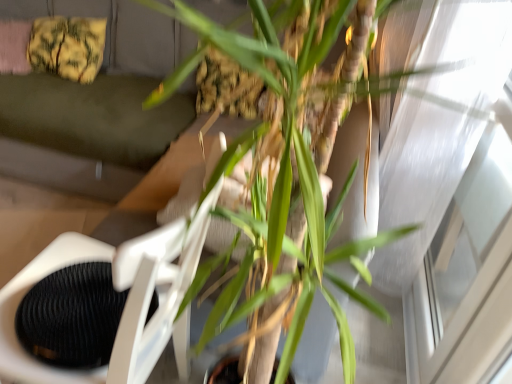
Image resolution: width=512 pixels, height=384 pixels. Describe the element at coordinates (451, 195) in the screenshot. I see `transparent glass window at upper right` at that location.

Describe the element at coordinates (125, 308) in the screenshot. I see `white plastic swivel chair at center` at that location.

In order to click on transparent glass window at upper right in this screenshot , I will do `click(451, 195)`.

How many degrees apart are the facing directions of transparent glass window at upper right and white plastic swivel chair at center?

There is a 3.96-degree angle between the facing directions of transparent glass window at upper right and white plastic swivel chair at center.

Which is behind, point (426, 151) or point (145, 281)?

The point (426, 151) is farther from the camera.

How much distance is there between transparent glass window at upper right and white plastic swivel chair at center?

A distance of 36.02 inches exists between transparent glass window at upper right and white plastic swivel chair at center.

From their relative heights in the image, would you say transparent glass window at upper right is taller or shorter than white plastic swivel chair at center?

Considering their sizes, transparent glass window at upper right has more height than white plastic swivel chair at center.

I want to click on couch that is above the transparent glass window at upper right (from the image's perspective), so click(x=100, y=89).

Between transparent glass window at upper right and green fabric couch at upper center, which one has less height?

With less height is green fabric couch at upper center.

From a real-world perspective, is transparent glass window at upper right below green fabric couch at upper center?

No.

Is transparent glass window at upper right wider than green fabric couch at upper center?

No.

Considering the positions of points (32, 38) and (260, 129), is point (32, 38) closer to camera compared to point (260, 129)?

No, (32, 38) is further to viewer.

From the picture: Between yellow fabric pillow at upper left and green leafy plant at center, which one has larger size?

green leafy plant at center.

Are yellow fabric pillow at upper left and green leafy plant at center beside each other?

They are not placed beside each other.

Which object is positioned more to the right, yellow fabric pillow at upper left or green leafy plant at center?

Positioned to the right is green leafy plant at center.

How many degrees apart are the facing directions of yellow fabric pillow at upper left and white plastic swivel chair at center?

The facing directions of yellow fabric pillow at upper left and white plastic swivel chair at center are 104 degrees apart.

Consider the image. Is yellow fabric pillow at upper left not near white plastic swivel chair at center?

Indeed, yellow fabric pillow at upper left is not near white plastic swivel chair at center.

Consider the image. Which of these two, yellow fabric pillow at upper left or white plastic swivel chair at center, is bigger?

white plastic swivel chair at center.

From the image's perspective, would you say yellow fabric pillow at upper left is positioned over white plastic swivel chair at center?

Yes, from the image's perspective, yellow fabric pillow at upper left is over white plastic swivel chair at center.

Is white plastic swivel chair at center oriented towards yellow fabric pillow at upper left?

No.

You are a GUI agent. You are given a task and a screenshot of the screen. Output one action in this format:
    pyautogui.click(x=<x>, y=<y>)
    Task: Click on the pillow that is on the left side of white plastic swivel chair at center
    
    Given the screenshot: What is the action you would take?
    pyautogui.click(x=67, y=47)

From a real-world perspective, is white plastic swivel chair at center physically located above or below yellow fabric pillow at upper left?

white plastic swivel chair at center is situated lower than yellow fabric pillow at upper left in the real world.

Is white plastic swivel chair at center next to yellow fabric pillow at upper left and touching it?

There is a gap between white plastic swivel chair at center and yellow fabric pillow at upper left.

Are green fabric couch at upper center and yellow fabric pillow at upper left making contact?

green fabric couch at upper center and yellow fabric pillow at upper left are clearly separated.

How much distance is there between green fabric couch at upper center and yellow fabric pillow at upper left?

green fabric couch at upper center and yellow fabric pillow at upper left are 21.66 centimeters apart.

Is point (32, 128) less distant than point (91, 67)?

Yes, it is in front of point (91, 67).

How many degrees apart are the facing directions of green fabric couch at upper center and yellow fabric pillow at upper left?

They differ by 9.56 degrees in their facing directions.

Is green fabric couch at upper center positioned in front of green leafy plant at center?

No, it is behind green leafy plant at center.

Considering the sizes of green fabric couch at upper center and green leafy plant at center in the image, is green fabric couch at upper center wider or thinner than green leafy plant at center?

In the image, green fabric couch at upper center appears to be wider than green leafy plant at center.

Is green fabric couch at upper center taller or shorter than green leafy plant at center?

In the image, green fabric couch at upper center appears to be shorter than green leafy plant at center.

Based on the photo, is green fabric couch at upper center facing towards green leafy plant at center?

No, green fabric couch at upper center is not aimed at green leafy plant at center.

The width and height of the screenshot is (512, 384). Find the location of `window that appears above the white plastic swivel chair at center (from a real-world perspective)`. window that appears above the white plastic swivel chair at center (from a real-world perspective) is located at coordinates [x=451, y=195].

Where is `window that appears on the right of green fabric couch at upper center`? window that appears on the right of green fabric couch at upper center is located at coordinates (451, 195).

Which object lies further to the anchor point green fabric couch at upper center, green leafy plant at center or yellow fabric pillow at upper left?

green leafy plant at center is positioned further to the anchor green fabric couch at upper center.

Which object lies nearer to the anchor point transparent glass window at upper right, yellow fabric pillow at upper left or white plastic swivel chair at center?

white plastic swivel chair at center is closer to transparent glass window at upper right.

Estimate the real-world distances between objects in this image. Which object is closer to green fabric couch at upper center, green leafy plant at center or white plastic swivel chair at center?

white plastic swivel chair at center is positioned closer to the anchor green fabric couch at upper center.

Looking at the image, which one is located further to white plastic swivel chair at center, green fabric couch at upper center or transparent glass window at upper right?

green fabric couch at upper center is positioned further to the anchor white plastic swivel chair at center.

When comparing their distances from green fabric couch at upper center, does green leafy plant at center or transparent glass window at upper right seem closer?

green leafy plant at center is closer to green fabric couch at upper center.

Considering their positions, is white plastic swivel chair at center positioned closer to green fabric couch at upper center than green leafy plant at center?

white plastic swivel chair at center is closer to green fabric couch at upper center.

When comparing their distances from transparent glass window at upper right, does green leafy plant at center or white plastic swivel chair at center seem further?

The object further to transparent glass window at upper right is white plastic swivel chair at center.

Considering their positions, is green leafy plant at center positioned further to white plastic swivel chair at center than yellow fabric pillow at upper left?

yellow fabric pillow at upper left is positioned further to the anchor white plastic swivel chair at center.

Locate an element on the screen. The height and width of the screenshot is (384, 512). window positioned between green leafy plant at center and yellow fabric pillow at upper left from near to far is located at coordinates (451, 195).

Where is `pillow situated between green fabric couch at upper center and transparent glass window at upper right from left to right`? This screenshot has width=512, height=384. pillow situated between green fabric couch at upper center and transparent glass window at upper right from left to right is located at coordinates (67, 47).

Locate an element on the screen. couch located between white plastic swivel chair at center and yellow fabric pillow at upper left in the depth direction is located at coordinates (100, 89).

This screenshot has width=512, height=384. I want to click on swivel chair between green leafy plant at center and yellow fabric pillow at upper left in the front-back direction, so click(x=125, y=308).